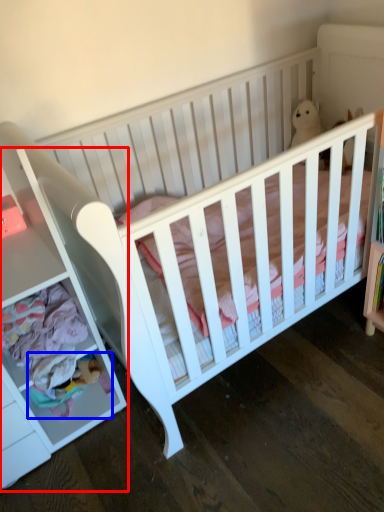
Question: Which of the following is the closest to the observer, dresser (highlighted by a red box) or toy (highlighted by a blue box)?

Choices:
 (A) dresser
 (B) toy

Answer: (A)